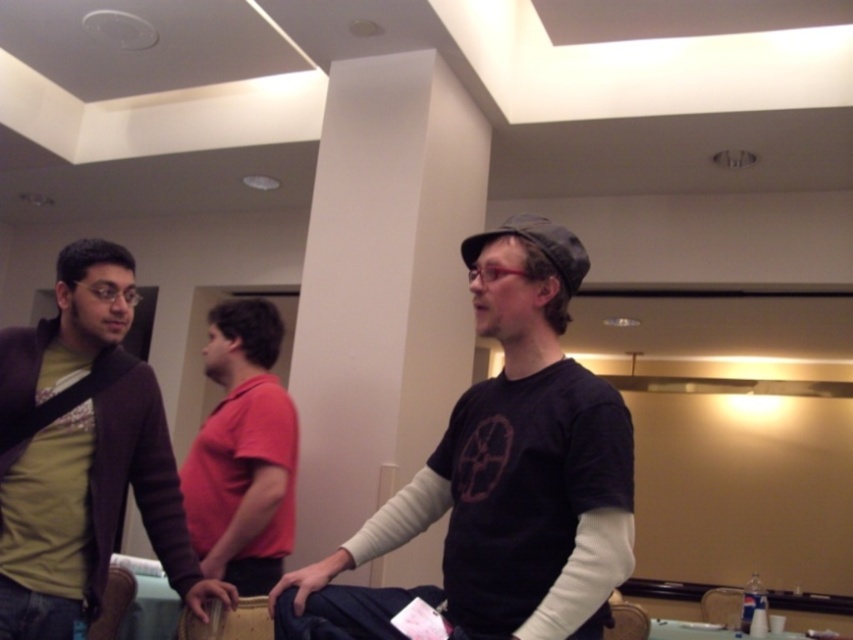
Is point (125, 356) farther from viewer compared to point (305, 572)?

Yes, point (125, 356) is farther from viewer.

I want to click on green matte shirt at left, so click(79, 451).

Locate an element on the screen. green matte shirt at left is located at coordinates (79, 451).

Can you confirm if green matte shirt at left is positioned to the right of red cotton shirt at center?

No, green matte shirt at left is not to the right of red cotton shirt at center.

Based on the photo, is green matte shirt at left further to camera compared to red cotton shirt at center?

No, green matte shirt at left is closer to the viewer.

Measure the distance between point (91, 465) and camera.

They are 1.69 meters apart.

The width and height of the screenshot is (853, 640). I want to click on green matte shirt at left, so click(79, 451).

I want to click on black matte shirt at center, so click(508, 474).

Between black matte shirt at center and matte blue jeans at lower center, which one appears on the right side from the viewer's perspective?

black matte shirt at center is more to the right.

Identify the location of black matte shirt at center. (508, 474).